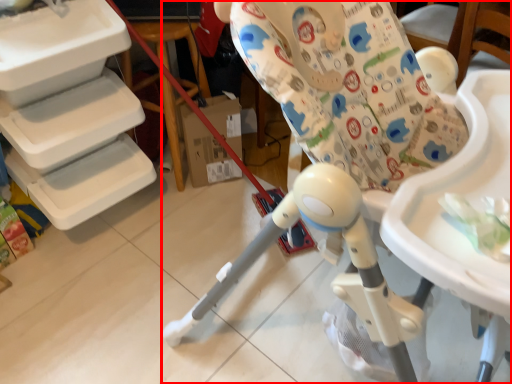
Question: From the image's perspective, what is the correct spatial relationship of chair (annotated by the red box) in relation to table?

Choices:
 (A) below
 (B) above

Answer: (A)